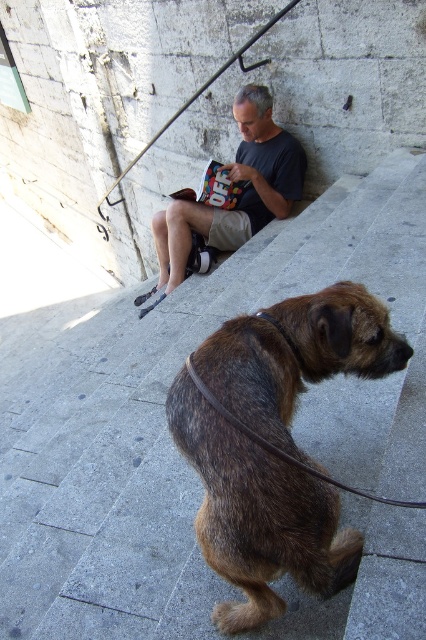
Question: Which is nearer to the brown leather leash at lower center?

Choices:
 (A) dark blue t-shirt at center
 (B) brown shaggy dog at lower center

Answer: (B)

Question: Which is farther from the brown shaggy dog at lower center?

Choices:
 (A) brown leather leash at lower center
 (B) dark blue t-shirt at center

Answer: (B)

Question: Which point appears closest to the camera in this image?

Choices:
 (A) (271, 380)
 (B) (169, 216)
 (C) (368, 497)

Answer: (C)

Question: Is brown shaggy dog at lower center above dark blue t-shirt at center?

Choices:
 (A) no
 (B) yes

Answer: (A)

Question: Where is dark blue t-shirt at center located in relation to brown leather leash at lower center in the image?

Choices:
 (A) below
 (B) above

Answer: (B)

Question: Can you confirm if brown shaggy dog at lower center is wider than dark blue t-shirt at center?

Choices:
 (A) yes
 (B) no

Answer: (B)